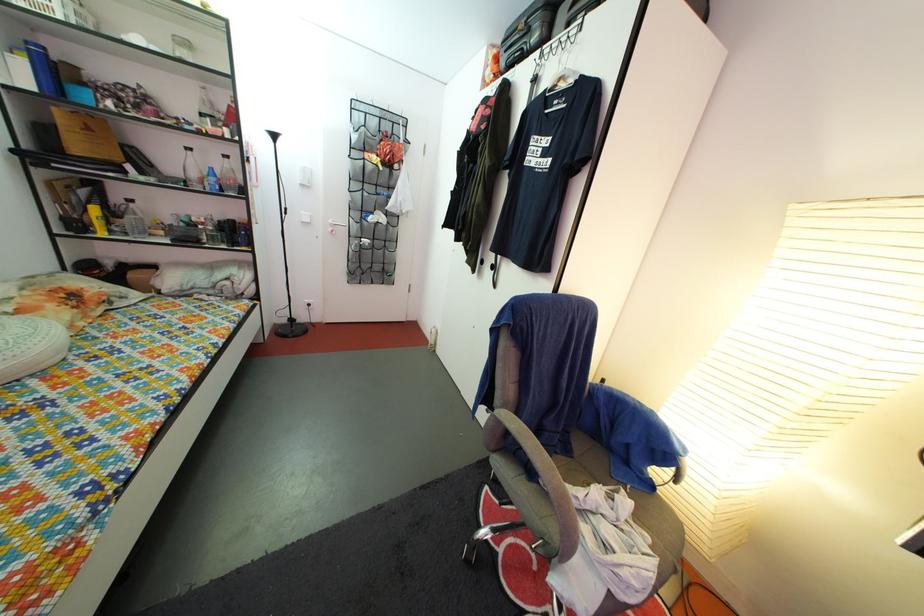
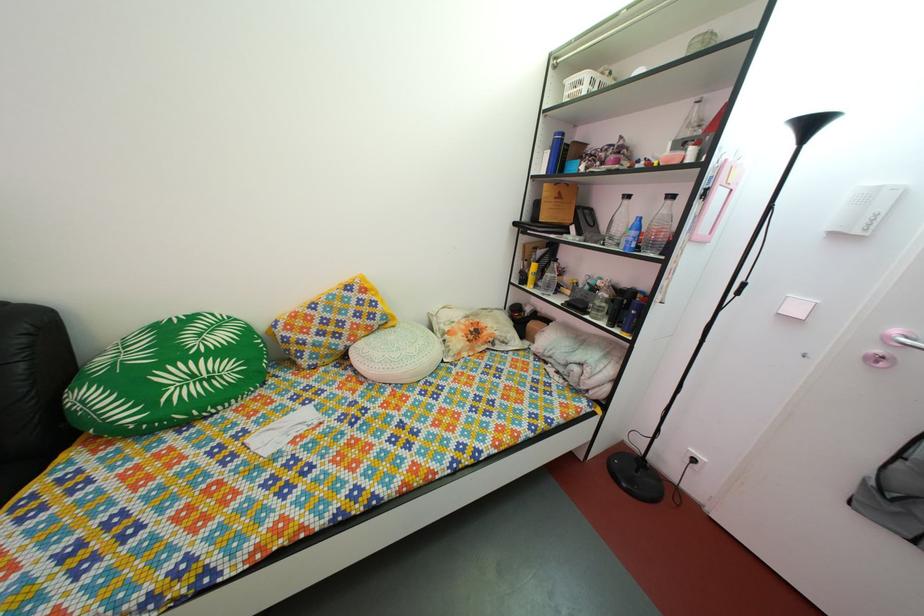
Where in the second image is the point corresponding to pixel 107 232 from the first image?

(540, 286)